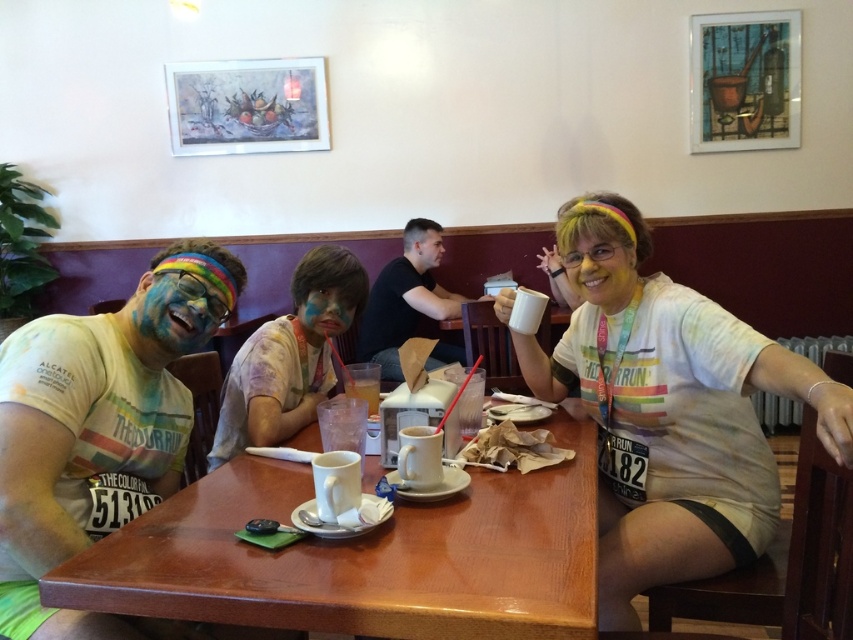
Is brown crumpled paper at table center positioned in front of smooth skin face at center?

Yes, it is.

Looking at this image, is brown crumpled paper at table center smaller than smooth skin face at center?

No, brown crumpled paper at table center is not smaller than smooth skin face at center.

What are the coordinates of `brown crumpled paper at table center` in the screenshot? It's located at (514, 449).

Can you confirm if white matte face at upper center is wider than translucent plastic cup at center?

Correct, the width of white matte face at upper center exceeds that of translucent plastic cup at center.

This screenshot has height=640, width=853. Find the location of `white matte face at upper center`. white matte face at upper center is located at coordinates (601, 273).

What do you see at coordinates (601, 273) in the screenshot?
I see `white matte face at upper center` at bounding box center [601, 273].

At what (x,y) coordinates should I click in order to perform the action: click on white matte face at upper center. Please return your answer as a coordinate pair (x, y). Looking at the image, I should click on (601, 273).

Can you confirm if white matte t-shirt at center is positioned to the left of black t-shirt at center?

In fact, white matte t-shirt at center is to the right of black t-shirt at center.

Does white matte t-shirt at center have a greater height compared to black t-shirt at center?

Yes.

Is point (578, 342) behind point (393, 276)?

That is False.

Find the location of a particular element. The height and width of the screenshot is (640, 853). white matte t-shirt at center is located at coordinates (672, 419).